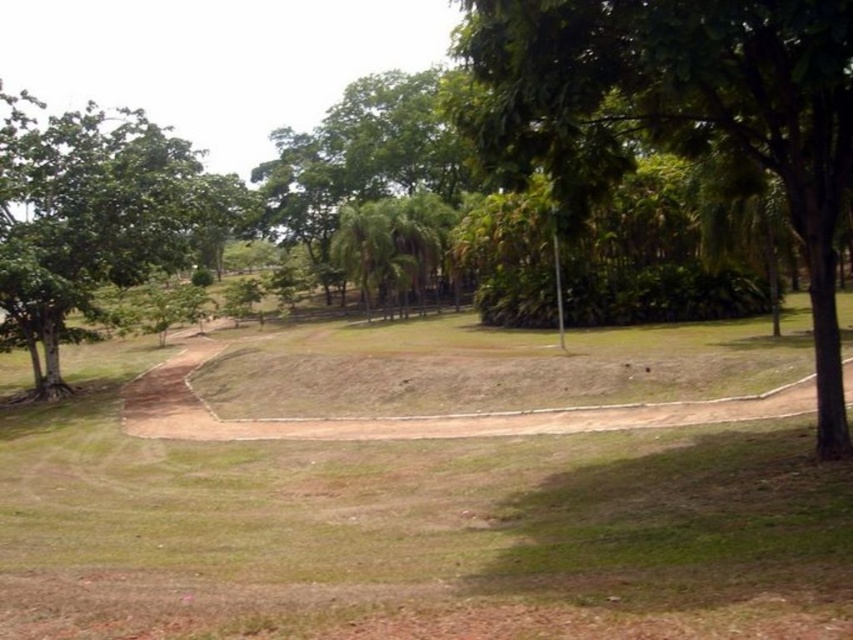
Who is positioned more to the left, green leafy tree at center or green leafy tree at left?

Positioned to the left is green leafy tree at left.

Is green leafy tree at center further to camera compared to green leafy tree at left?

No, green leafy tree at center is in front of green leafy tree at left.

The height and width of the screenshot is (640, 853). Find the location of `green leafy tree at center`. green leafy tree at center is located at coordinates [677, 115].

Locate an element on the screen. green leafy tree at center is located at coordinates (677, 115).